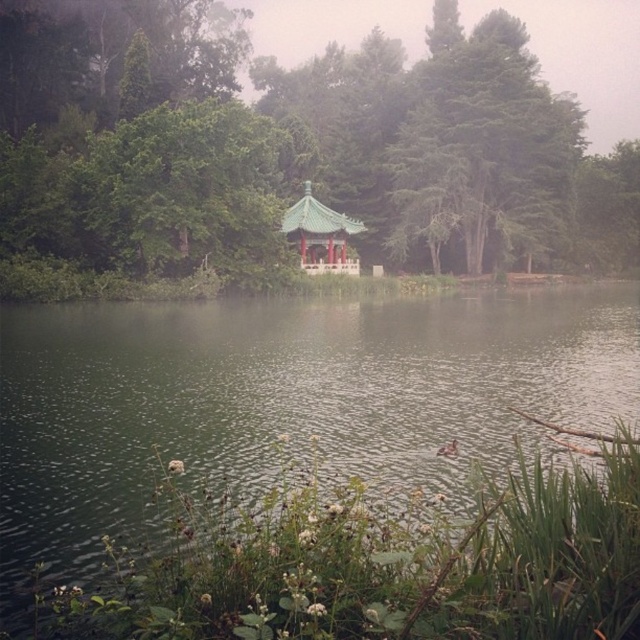
You are an ornithologist observing birds in the serene lakeside scene. You notice two trees in the image, the green leafy tree at center and the green textured tree at upper center. Which tree is positioned higher in the scene?

The green leafy tree at center is positioned higher than the green textured tree at upper center.

You are standing at the lakeside and see two points in the scene. The first point is at coordinates point (x=221, y=378) and the second is at point (x=576, y=161). Which point is nearer to your current position?

Point (x=221, y=378) is closer to the camera than point (x=576, y=161), so the first point is nearer to your current position.